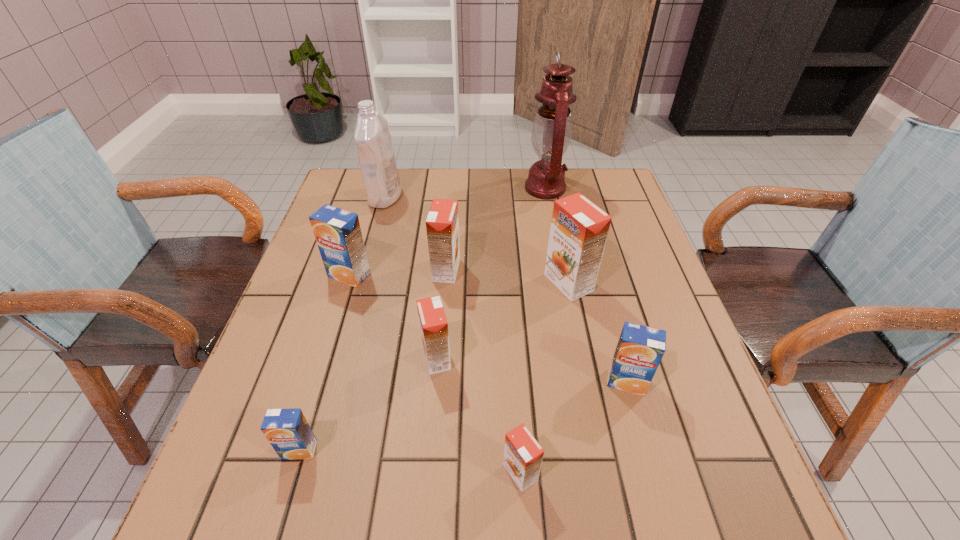
Point out which blue orange_juice is positioned as the third nearest to the tallest orange juice. Please provide its 2D coordinates. Your answer should be formatted as a tuple, i.e. [(x, y)], where the tuple contains the x and y coordinates of a point satisfying the conditions above.

[(287, 430)]

Identify which blue orange_juice is the second nearest to the biggest blue orange_juice. Please provide its 2D coordinates. Your answer should be formatted as a tuple, i.e. [(x, y)], where the tuple contains the x and y coordinates of a point satisfying the conditions above.

[(640, 348)]

Find the location of a particular element. This screenshot has width=960, height=540. vacant position in the image that satisfies the following two spatial constraints: 1. on the front side of the sixth object from left to right; 2. on the right side of the third smallest orange orange juice is located at coordinates (430, 472).

At what (x,y) coordinates should I click in order to perform the action: click on vacant area that satisfies the following two spatial constraints: 1. on the back side of the second nearest orange orange juice; 2. on the left side of the rightmost orange orange juice. Please return your answer as a coordinate pair (x, y). This screenshot has height=540, width=960. Looking at the image, I should click on (444, 283).

At what (x,y) coordinates should I click in order to perform the action: click on free region that satisfies the following two spatial constraints: 1. on the front side of the smallest orange orange juice; 2. on the right side of the smallest blue orange_juice. Please return your answer as a coordinate pair (x, y). Looking at the image, I should click on (293, 472).